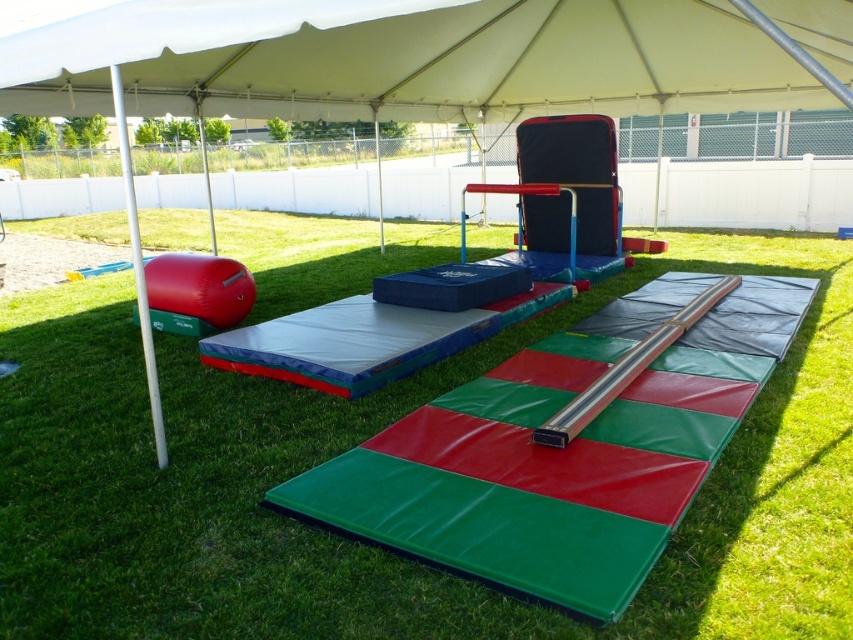
Is white fabric canopy at upper center shorter than white smooth pole at left?

Correct, white fabric canopy at upper center is not as tall as white smooth pole at left.

Can you confirm if white fabric canopy at upper center is bigger than white smooth pole at left?

No, white fabric canopy at upper center is not bigger than white smooth pole at left.

Which is in front, point (437, 67) or point (135, 273)?

Positioned in front is point (135, 273).

Find the location of a particular element. The width and height of the screenshot is (853, 640). white fabric canopy at upper center is located at coordinates (403, 60).

Between green soft grass at center and white smooth pole at left, which one has less height?

green soft grass at center is shorter.

Is green soft grass at center positioned behind white smooth pole at left?

No, it is in front of white smooth pole at left.

Which is in front, point (442, 372) or point (120, 140)?

Point (442, 372)

I want to click on green soft grass at center, so click(x=360, y=442).

Between green soft grass at center and white fabric canopy at upper center, which one appears on the left side from the viewer's perspective?

white fabric canopy at upper center

Does green soft grass at center appear on the right side of white fabric canopy at upper center?

Indeed, green soft grass at center is positioned on the right side of white fabric canopy at upper center.

Where is `green soft grass at center`? The image size is (853, 640). green soft grass at center is located at coordinates (360, 442).